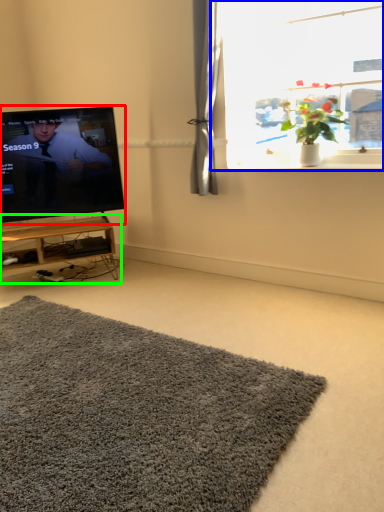
Question: Which is farther away from television (highlighted by a red box)? window (highlighted by a blue box) or table (highlighted by a green box)?

Choices:
 (A) window
 (B) table

Answer: (A)